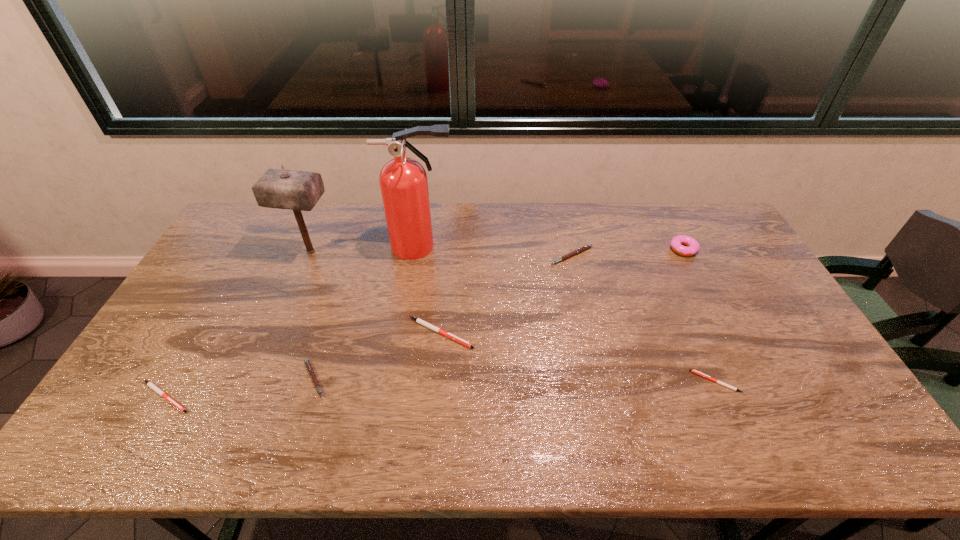
The height and width of the screenshot is (540, 960). In order to click on the tallest object in this screenshot , I will do `click(403, 181)`.

Locate an element on the screen. This screenshot has height=540, width=960. the second tallest object is located at coordinates (299, 191).

Find the location of `the seventh object from right to left`. the seventh object from right to left is located at coordinates (299, 191).

I want to click on pink doughnut, so click(x=676, y=243).

The image size is (960, 540). What are the coordinates of `doughnut` in the screenshot? It's located at (676, 243).

Identify the location of the farthest pen. The height and width of the screenshot is (540, 960). (581, 249).

The height and width of the screenshot is (540, 960). I want to click on the farther pink pen, so click(581, 249).

You are a GUI agent. You are given a task and a screenshot of the screen. Output one action in this format:
    pyautogui.click(x=<x>, y=<y>)
    Task: Click on the third pen from left to right
    This screenshot has width=960, height=540.
    Given the screenshot: What is the action you would take?
    pyautogui.click(x=422, y=322)

Find the location of a particular element. Image resolution: width=960 pixels, height=540 pixels. the fourth nearest pen is located at coordinates point(422,322).

The width and height of the screenshot is (960, 540). Identify the location of the third object from left to right. (309, 367).